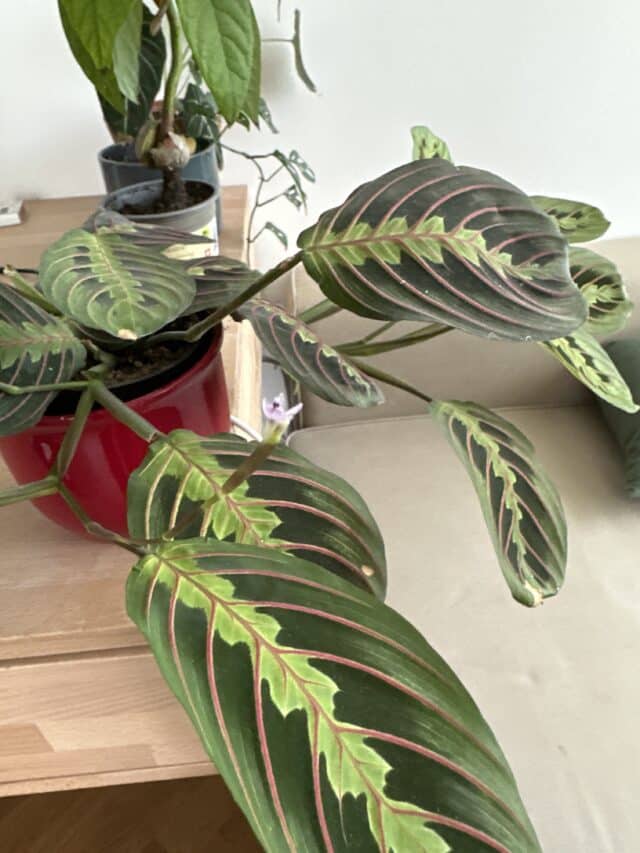
Locate an element on the screen. This screenshot has width=640, height=853. floor is located at coordinates (159, 827).